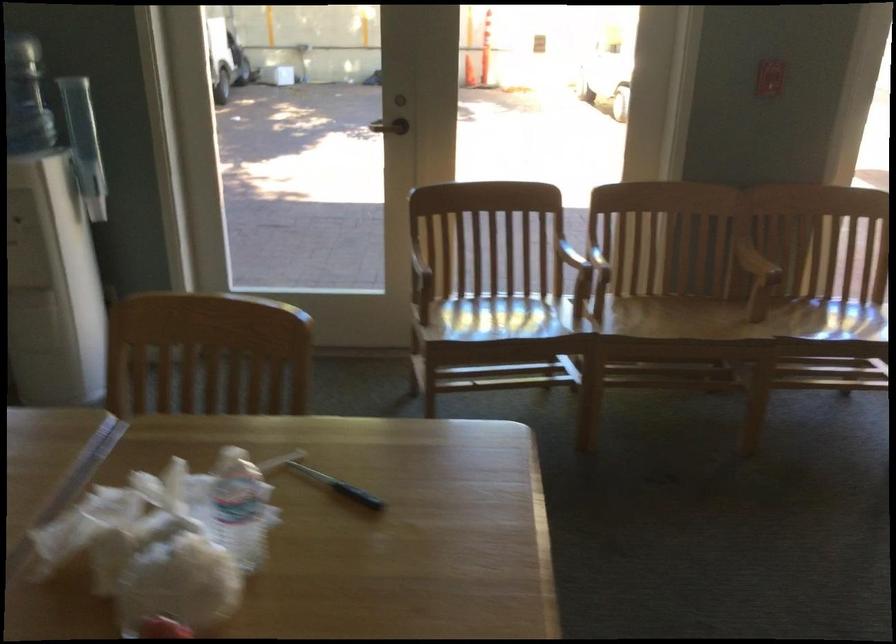
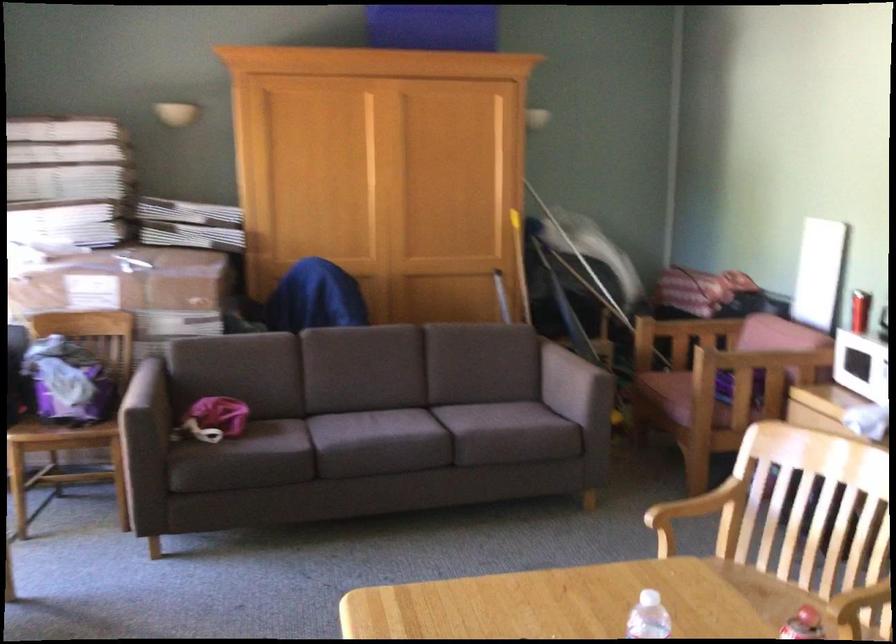
Find the pixel in the second image that matches [202,529] in the first image.

(648, 617)